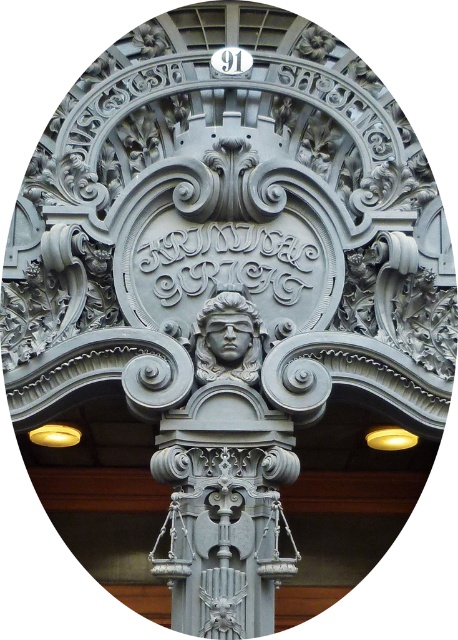
Question: Is matte gray statue at center closer to the viewer compared to matte gray stone face at center?

Choices:
 (A) no
 (B) yes

Answer: (A)

Question: From the image, what is the correct spatial relationship of matte gray statue at center in relation to matte gray stone face at center?

Choices:
 (A) above
 (B) below

Answer: (A)

Question: Which object appears farthest from the camera in this image?

Choices:
 (A) matte gray statue at center
 (B) matte gray stone face at center

Answer: (A)

Question: Can you confirm if matte gray statue at center is thinner than matte gray stone face at center?

Choices:
 (A) no
 (B) yes

Answer: (A)